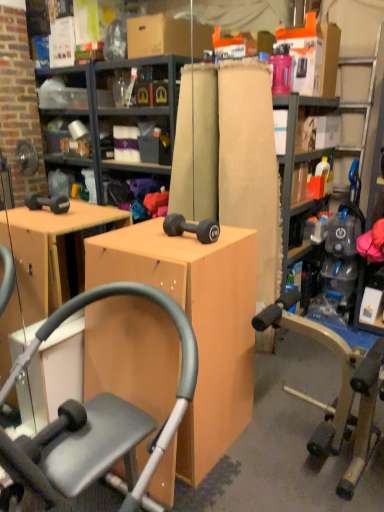
Question: Would you say matte wood desk at center is inside or outside matte cardboard shelf at upper center?

Choices:
 (A) outside
 (B) inside

Answer: (A)

Question: From a real-world perspective, is matte wood desk at center above or below matte cardboard shelf at upper center?

Choices:
 (A) below
 (B) above

Answer: (A)

Question: Based on their relative distances, which object is nearer to the matte cardboard shelf at upper center?

Choices:
 (A) matte black exercise machine at center
 (B) wooden bookshelf at center
 (C) matte wood desk at center
 (D) matte black dumbbell at center

Answer: (B)

Question: Considering the real-world distances, which object is farthest from the matte black dumbbell at center?

Choices:
 (A) matte black exercise machine at center
 (B) matte cardboard shelf at upper center
 (C) wooden bookshelf at center
 (D) matte wood desk at center

Answer: (B)